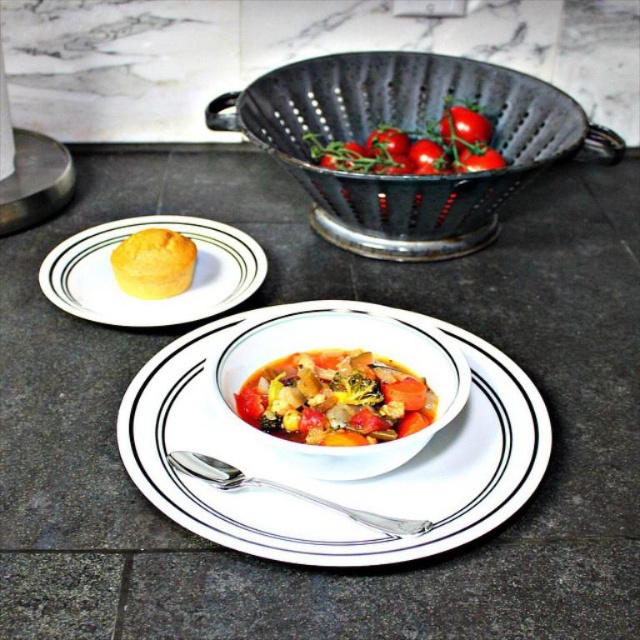
Question: Which object is positioned farthest from the red matte tomato at upper center?

Choices:
 (A) white glossy bowl at center
 (B) vibrant mixed vegetable stew at center
 (C) black metal colander at upper center

Answer: (B)

Question: Is silver metallic spoon at center above red matte tomato at center?

Choices:
 (A) yes
 (B) no

Answer: (B)

Question: In this image, where is yellow matte muffin at upper left located relative to red matte tomato at upper center?

Choices:
 (A) below
 (B) above

Answer: (A)

Question: Which point is farther from the camera taking this photo?

Choices:
 (A) (438, 166)
 (B) (464, 154)

Answer: (B)

Question: Can you confirm if yellow matte muffin at left is bigger than glossy red tomato at upper center?

Choices:
 (A) no
 (B) yes

Answer: (B)

Question: Which point is farther to the camera?

Choices:
 (A) yellow matte muffin at upper left
 (B) silver metallic spoon at center
 (C) white glossy bowl at center
 (D) glossy red tomato at upper center

Answer: (D)